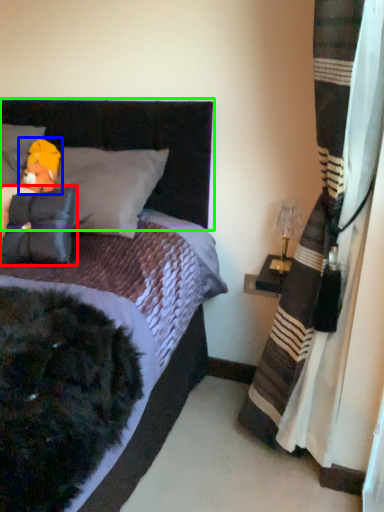
Question: Which object is the closest to the pillow (highlighted by a red box)? Choose among these: toy (highlighted by a blue box) or headboard (highlighted by a green box).

Choices:
 (A) toy
 (B) headboard

Answer: (A)